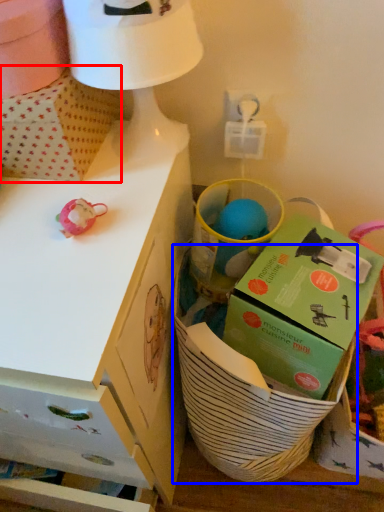
Question: Which object is further to the camera taking this photo, cardboard box (highlighted by a red box) or basket (highlighted by a blue box)?

Choices:
 (A) cardboard box
 (B) basket

Answer: (A)